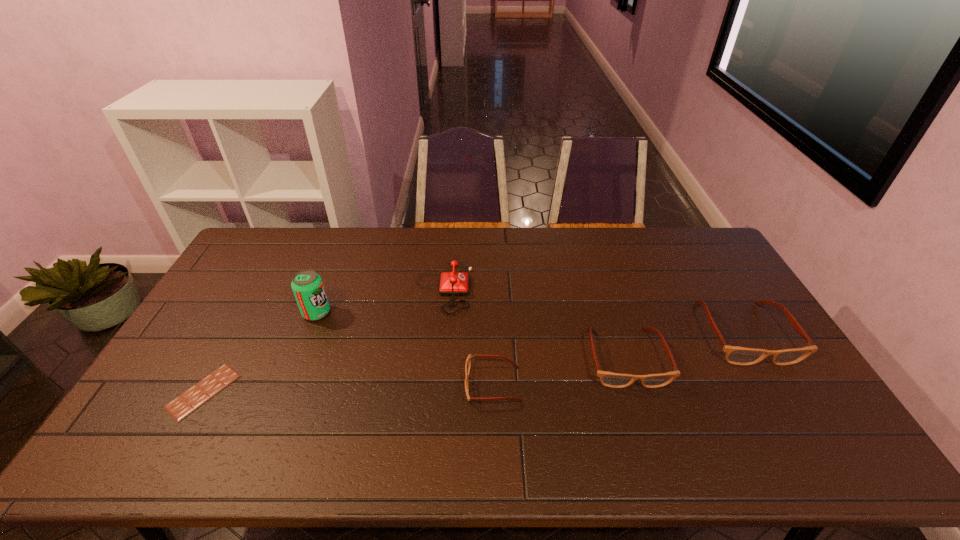
This screenshot has width=960, height=540. I want to click on vacant space positioned 0.220m on the front-facing side of the leftmost spectacles, so click(x=384, y=384).

Identify the location of vacant area situated on the front-facing side of the leftmost spectacles. This screenshot has width=960, height=540. (366, 384).

This screenshot has width=960, height=540. Find the location of `vacant space located 0.190m on the front-facing side of the leftmost spectacles`. vacant space located 0.190m on the front-facing side of the leftmost spectacles is located at coordinates (396, 384).

Locate an element on the screen. This screenshot has width=960, height=540. vacant space located 0.100m on the front-facing side of the second spectacles from right to left is located at coordinates (646, 425).

Locate an element on the screen. The height and width of the screenshot is (540, 960). vacant point located 0.140m on the front-facing side of the rightmost spectacles is located at coordinates (791, 413).

Locate an element on the screen. The height and width of the screenshot is (540, 960). free region located 0.290m on the dial of the telephone is located at coordinates (558, 287).

The height and width of the screenshot is (540, 960). What are the coordinates of `vacant region located 0.380m on the front-facing side of the tallest object` in the screenshot? It's located at (450, 313).

The image size is (960, 540). Find the location of `free spot located 0.050m on the left of the chocolate bar`. free spot located 0.050m on the left of the chocolate bar is located at coordinates (155, 392).

Find the location of a particular element. The width and height of the screenshot is (960, 540). object positioned at the far edge is located at coordinates pos(452,283).

Where is `spectacles that is at the near edge`? The width and height of the screenshot is (960, 540). spectacles that is at the near edge is located at coordinates (468, 361).